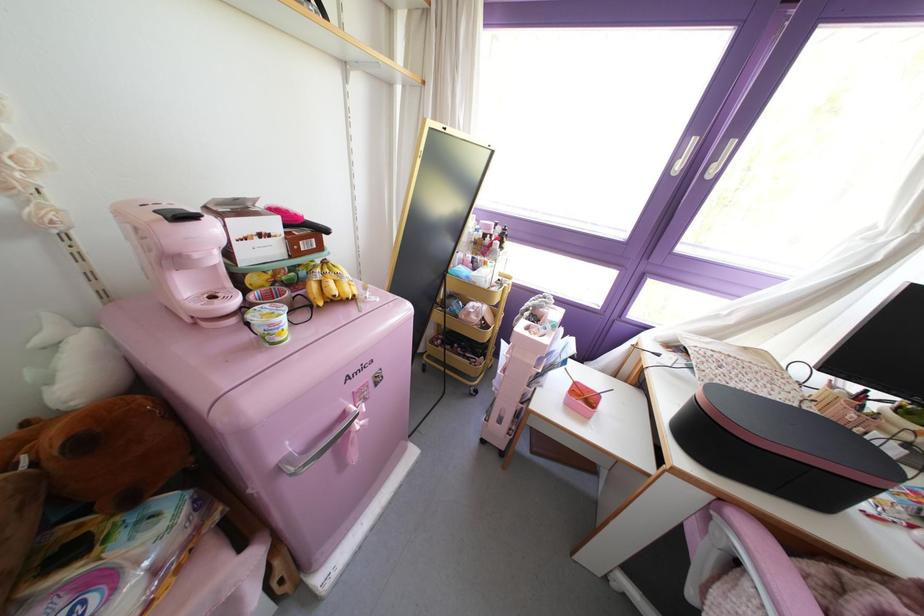
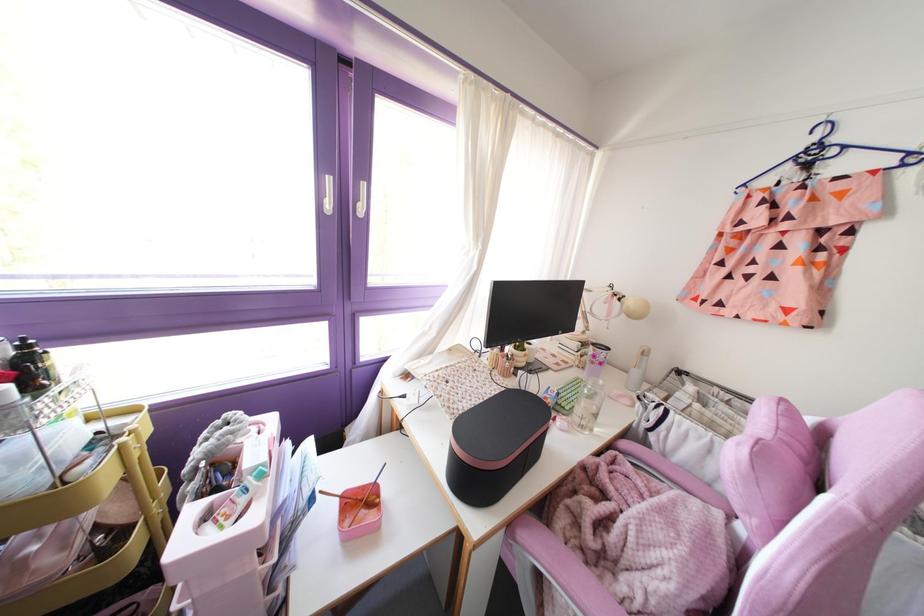
Find the pixel in the second image that matches point (553, 328) in the first image.

(261, 475)